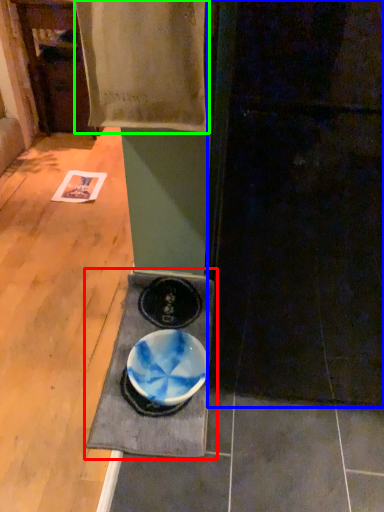
Question: Which object is positioned closest to table (highlighted by a red box)? Select from door (highlighted by a blue box) and blanket (highlighted by a green box).

Choices:
 (A) door
 (B) blanket

Answer: (A)